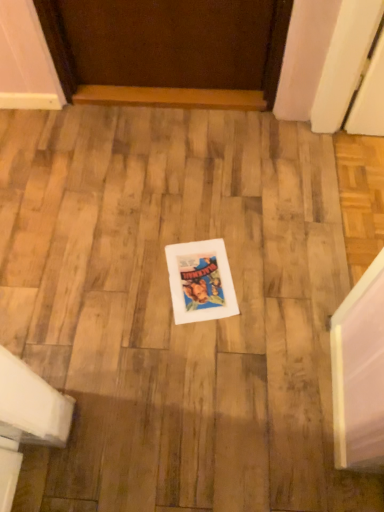
Image resolution: width=384 pixels, height=512 pixels. I want to click on matte paper comic book at center, so click(x=200, y=281).

The width and height of the screenshot is (384, 512). Describe the element at coordinates (200, 281) in the screenshot. I see `matte paper comic book at center` at that location.

What is the approximate width of matte paper comic book at center?

It is 12.06 inches.

Find the location of a particular element. This screenshot has height=512, width=384. matte paper comic book at center is located at coordinates (200, 281).